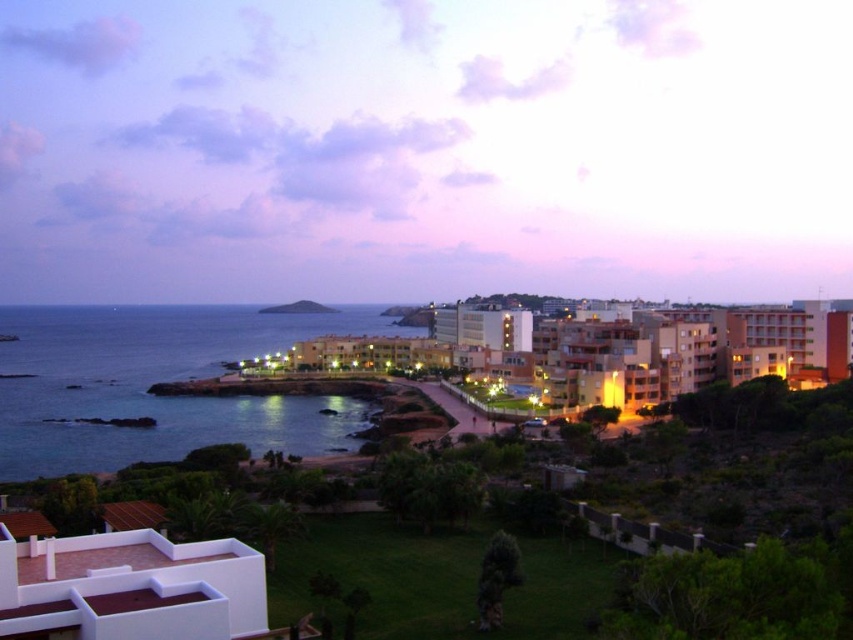
Question: Considering the relative positions of blue water at lower left and white matte roof at lower left in the image provided, where is blue water at lower left located with respect to white matte roof at lower left?

Choices:
 (A) above
 (B) below

Answer: (A)

Question: Can you confirm if orange brick hotel at center is thinner than white matte roof at lower left?

Choices:
 (A) no
 (B) yes

Answer: (A)

Question: Is blue water at lower left positioned behind green grassy hillside at center?

Choices:
 (A) yes
 (B) no

Answer: (B)

Question: Which of the following is the farthest from the observer?

Choices:
 (A) orange brick hotel at center
 (B) green grassy hillside at center

Answer: (B)

Question: Estimate the real-world distances between objects in this image. Which object is closer to the orange brick hotel at center?

Choices:
 (A) blue water at lower left
 (B) white matte roof at lower left
 (C) green grassy hillside at center

Answer: (A)

Question: Which object is closer to the camera taking this photo?

Choices:
 (A) white matte roof at lower left
 (B) blue water at lower left

Answer: (A)